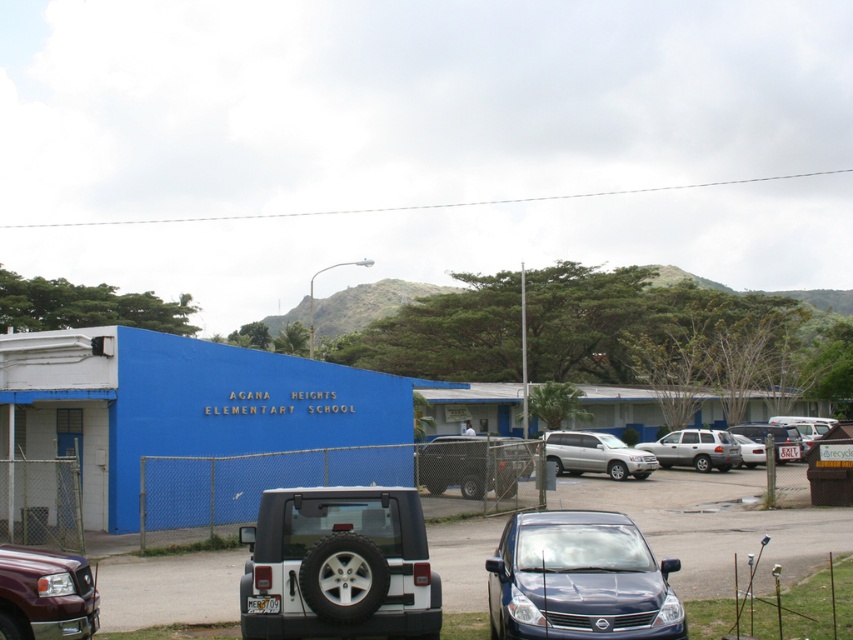
Question: Which of these objects is positioned farthest from the silver metallic suv at center?

Choices:
 (A) black plastic license plate at center
 (B) metallic gray license plate at center
 (C) white matte jeep at lower center
 (D) white matte sedan at right

Answer: (B)

Question: Does silver metallic suv at center appear on the left side of black plastic license plate at center?

Choices:
 (A) yes
 (B) no

Answer: (B)

Question: Which point is farther to the camera?

Choices:
 (A) satin silver suv at center
 (B) matte black jeep at center

Answer: (A)

Question: Does glossy blue car at center have a smaller size compared to black plastic license plate at center?

Choices:
 (A) no
 (B) yes

Answer: (A)

Question: Which point is closer to the camera taking this photo?

Choices:
 (A) (605, 618)
 (B) (465, 483)
 (C) (758, 451)
 (D) (793, 452)

Answer: (A)

Question: Does metallic silver car at center have a greater width compared to silver metallic suv at center?

Choices:
 (A) yes
 (B) no

Answer: (A)